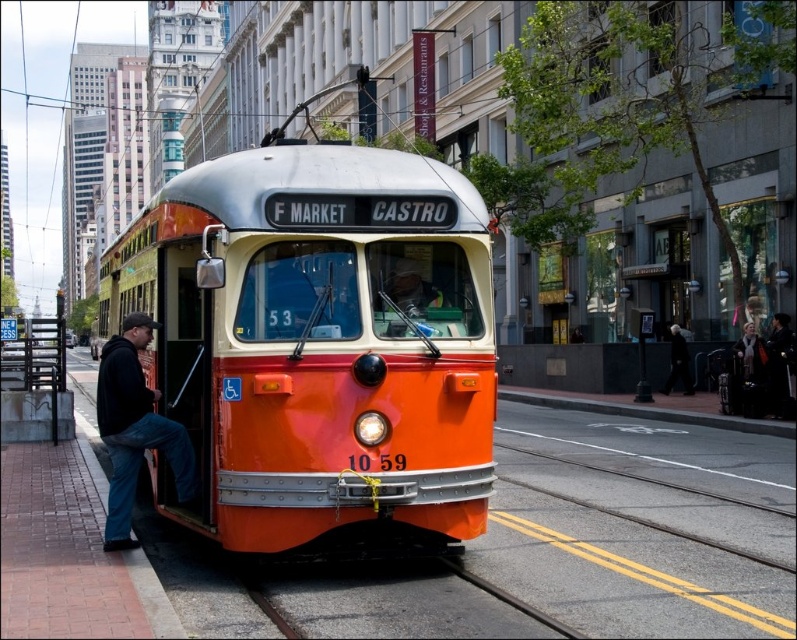
You are a passenger waiting to board the F Market Castro streetcar. You see a man wearing a black cotton jacket at left and a white scarf at center. Which item is higher up from the ground?

The black cotton jacket at left is located above the white scarf at center, so the black cotton jacket at left is higher up from the ground.

You are standing at the front destination sign of the F Market Castro streetcar. If you look towards the point labeled as point [509,600], what object would you see in that direction?

The point [509,600] corresponds to the metallic track at center, so you would see the metallic track at center in that direction.

You are a passenger trying to board the F Market Castro streetcar. You notice a man in a black cotton jacket at left and a white scarf at center. Which object is closer to the streetcar door?

The black cotton jacket at left is closer to the streetcar door because it is positioned to the left of the white scarf at center, which is closer to the center of the scene.